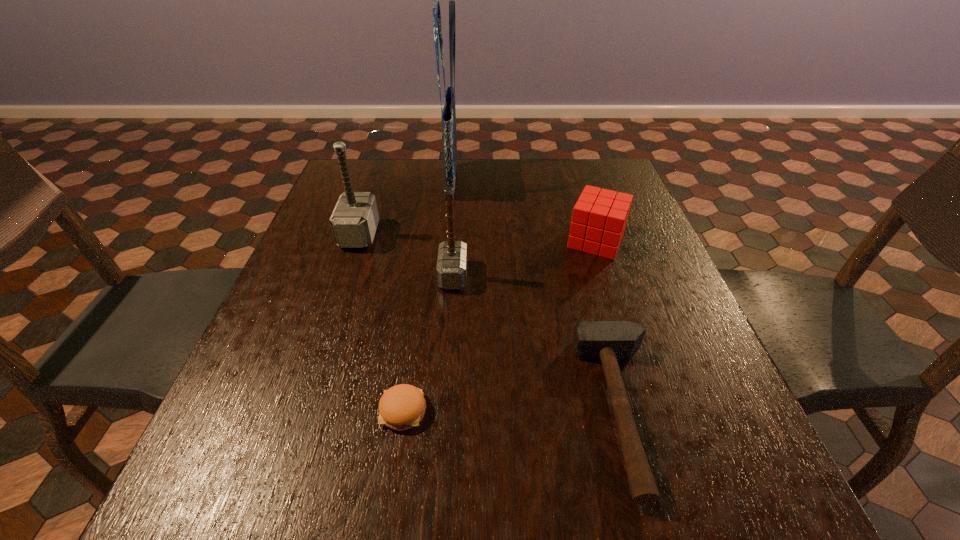
At what (x,y) coordinates should I click in order to perform the action: click on free space located for striking with the head of the leftmost hammer. Please return your answer as a coordinate pair (x, y). This screenshot has width=960, height=540. Looking at the image, I should click on (496, 234).

Find the location of a particular element. free space located on the striking surface of the second hammer from left to right is located at coordinates (536, 275).

At what (x,y) coordinates should I click in order to perform the action: click on vacant space located 0.220m on the front of the cube. Please return your answer as a coordinate pair (x, y). This screenshot has width=960, height=540. Looking at the image, I should click on (624, 329).

I want to click on free spot located on the striking surface of the fifth tallest object, so point(390,410).

Find the location of a particular element. The width and height of the screenshot is (960, 540). vacant region located on the striking surface of the fifth tallest object is located at coordinates (534, 410).

Locate an element on the screen. free space located 0.110m on the striking surface of the fifth tallest object is located at coordinates (522, 410).

Locate an element on the screen. This screenshot has width=960, height=540. blank area located 0.370m on the right of the shortest object is located at coordinates (640, 411).

Image resolution: width=960 pixels, height=540 pixels. Find the location of `object that is at the far edge`. object that is at the far edge is located at coordinates [x=448, y=116].

You are a GUI agent. You are given a task and a screenshot of the screen. Output one action in this format:
    pyautogui.click(x=<x>, y=<y>)
    Task: Click on the object that is at the near edge
    
    Given the screenshot: What is the action you would take?
    pyautogui.click(x=608, y=341)

The height and width of the screenshot is (540, 960). In order to click on object that is at the left edge in this screenshot , I will do `click(354, 220)`.